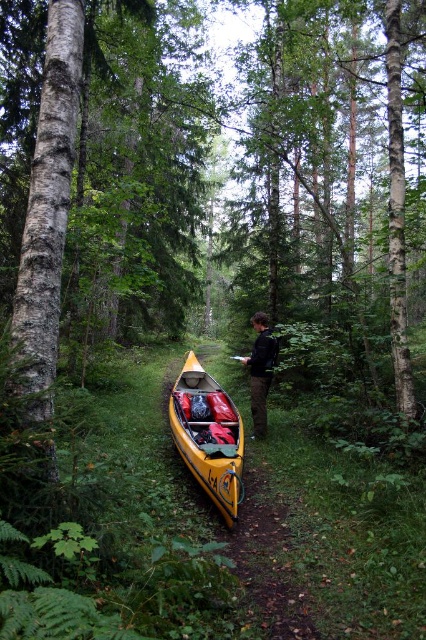
Does black fabric person at center come in front of wooden paddle at center?

That is False.

Who is more distant from viewer, [256,417] or [193,426]?

The point [256,417] is behind.

The width and height of the screenshot is (426, 640). I want to click on black fabric person at center, so click(261, 371).

Who is taller, yellow matte canoe at center or black fabric person at center?

black fabric person at center is taller.

Is point (238, 451) farther from camera compared to point (258, 378)?

That is False.

Between point (175, 440) and point (258, 417), which one is positioned behind?

The point (258, 417) is behind.

The width and height of the screenshot is (426, 640). Identify the location of yellow matte canoe at center. (207, 436).

Can you confirm if yellow matte canoe at center is thinner than wooden paddle at center?

No, yellow matte canoe at center is not thinner than wooden paddle at center.

Where is `yellow matte canoe at center`? The width and height of the screenshot is (426, 640). yellow matte canoe at center is located at coordinates (207, 436).